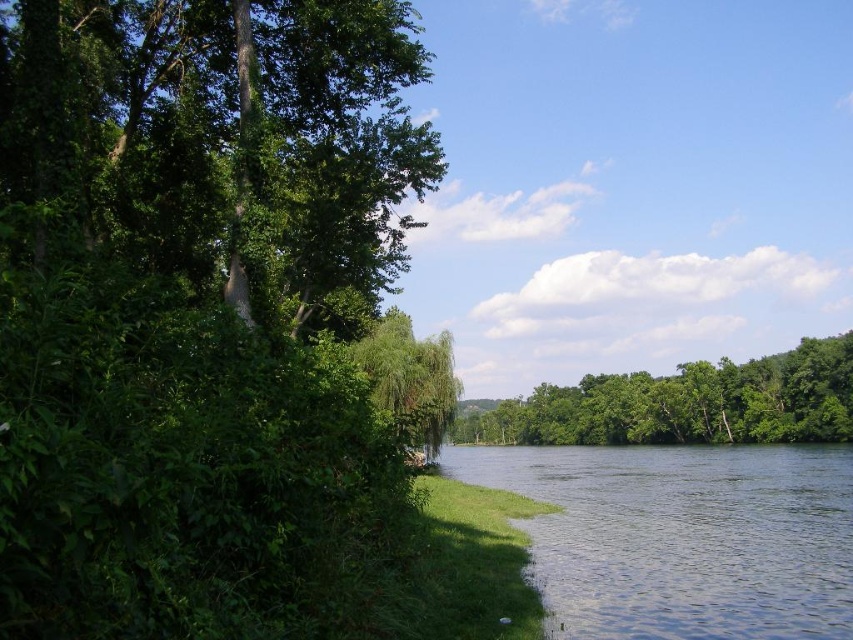
Can you confirm if clear water at lower right is positioned above green leafy tree at center?

Yes.

Can you confirm if clear water at lower right is thinner than green leafy tree at center?

Yes.

Where is `clear water at lower right`? The width and height of the screenshot is (853, 640). clear water at lower right is located at coordinates click(682, 538).

Describe the element at coordinates (196, 307) in the screenshot. I see `green leafy tree at left` at that location.

Is point (3, 72) positioned in front of point (682, 556)?

That is True.

You are a GUI agent. You are given a task and a screenshot of the screen. Output one action in this format:
    pyautogui.click(x=<x>, y=<y>)
    Task: Click on the green leafy tree at left
    This screenshot has height=640, width=853.
    Given the screenshot: What is the action you would take?
    pyautogui.click(x=196, y=307)

Describe the element at coordinates (196, 307) in the screenshot. I see `green leafy tree at left` at that location.

Who is more distant from viewer, [228,241] or [509,436]?

The point [509,436] is more distant.

The width and height of the screenshot is (853, 640). I want to click on green leafy tree at left, so click(196, 307).